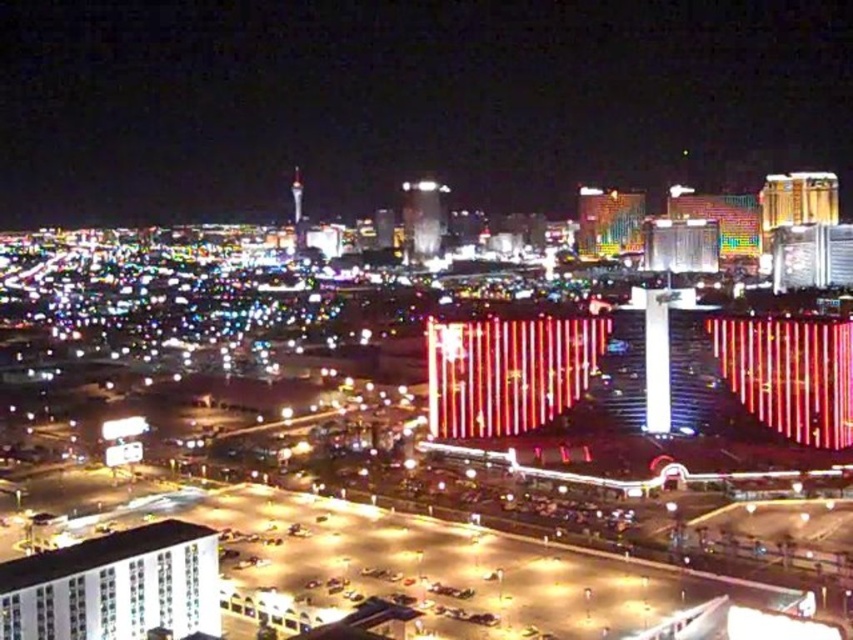
Question: Can you confirm if glittering neon lights at center is positioned to the left of white glossy building at lower left?

Choices:
 (A) yes
 (B) no

Answer: (B)

Question: Among these objects, which one is farthest from the camera?

Choices:
 (A) white glossy building at lower left
 (B) glittering neon lights at center

Answer: (B)

Question: Which point is closer to the camera taking this photo?

Choices:
 (A) (680, 163)
 (B) (113, 566)

Answer: (B)

Question: Can you confirm if glittering neon lights at center is positioned below white glossy building at lower left?

Choices:
 (A) no
 (B) yes

Answer: (A)

Question: Which object appears closest to the camera in this image?

Choices:
 (A) white glossy building at lower left
 (B) glittering neon lights at center

Answer: (A)

Question: Does glittering neon lights at center have a smaller size compared to white glossy building at lower left?

Choices:
 (A) yes
 (B) no

Answer: (B)